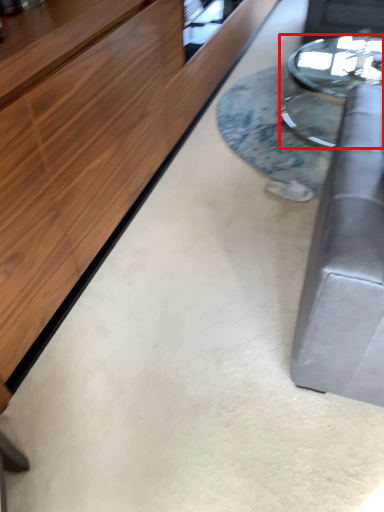
Question: Where is table (annotated by the red box) located in relation to table in the image?

Choices:
 (A) right
 (B) left

Answer: (A)